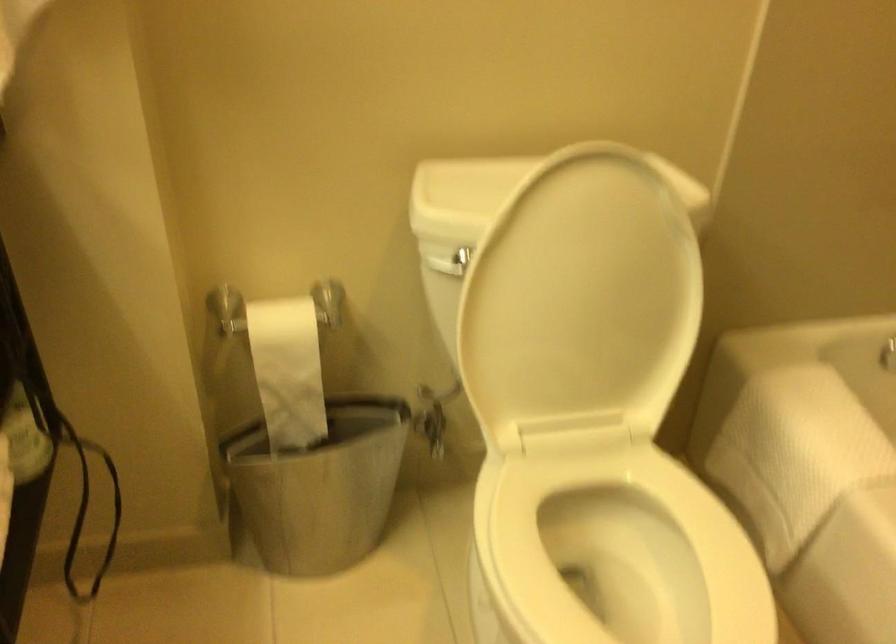
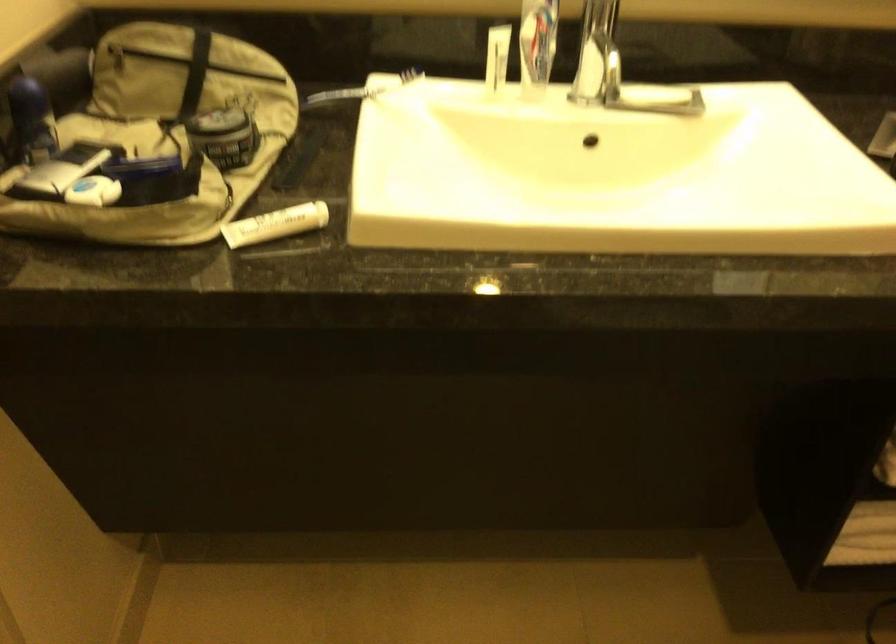
First-person continuous shooting, in which direction is the camera rotating?

The camera's rotation is toward left-down.